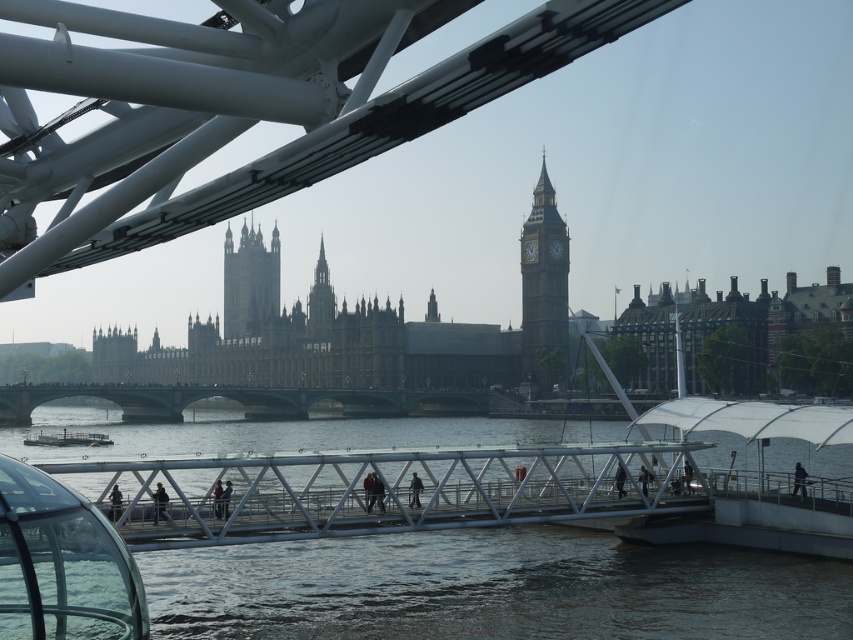
Does golden stone clock tower at center appear under dark brown stone tower at center?

Yes, golden stone clock tower at center is below dark brown stone tower at center.

Which is more to the left, golden stone clock tower at center or dark brown stone tower at center?

Positioned to the left is dark brown stone tower at center.

Is point (538, 348) closer to viewer compared to point (253, 266)?

That is True.

Image resolution: width=853 pixels, height=640 pixels. In order to click on golden stone clock tower at center in this screenshot , I will do `click(543, 289)`.

Is point (277, 259) positioned in front of point (78, 444)?

That is False.

Is dark brown stone tower at center below white plastic boat at lower left?

Incorrect, dark brown stone tower at center is not positioned below white plastic boat at lower left.

The image size is (853, 640). What do you see at coordinates (250, 282) in the screenshot? I see `dark brown stone tower at center` at bounding box center [250, 282].

At what (x,y) coordinates should I click in order to perform the action: click on dark brown stone tower at center. Please return your answer as a coordinate pair (x, y). The image size is (853, 640). Looking at the image, I should click on (250, 282).

What do you see at coordinates (320, 301) in the screenshot?
I see `brown stone tower at center` at bounding box center [320, 301].

Locate an element on the screen. brown stone tower at center is located at coordinates (320, 301).